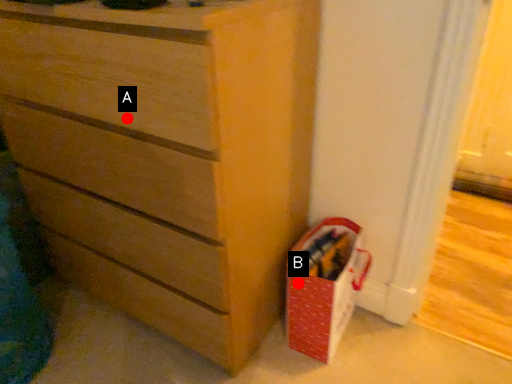
Question: Two points are circled on the image, labeled by A and B beside each circle. Which point is closer to the camera?

Choices:
 (A) A is closer
 (B) B is closer

Answer: (A)